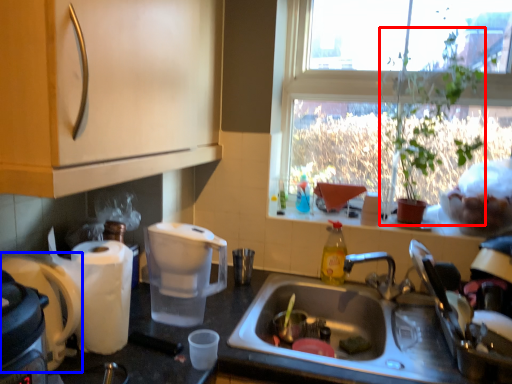
Question: Among these objects, which one is farthest to the camera, houseplant (highlighted by a red box) or coffee maker (highlighted by a blue box)?

Choices:
 (A) houseplant
 (B) coffee maker

Answer: (A)